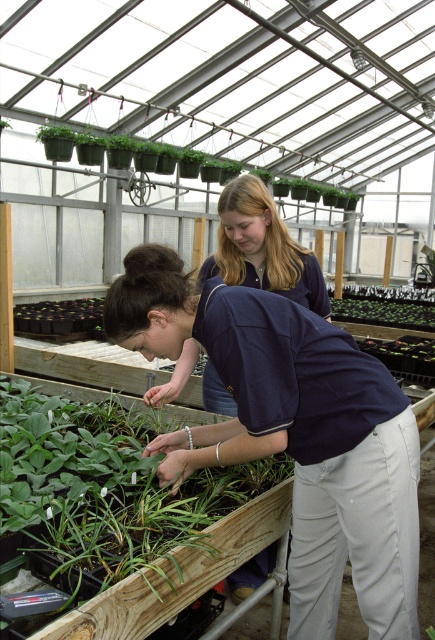
You are standing at the entrance of the greenhouse and see two points marked in the scene. Which point is closer to you, point (214, 461) or point (391, 301)?

Point (214, 461) is in front of point (391, 301), so it is closer to you.

You are a maintenance worker in the greenhouse. You need to reach the green matte hanging plants at upper center from the green leafy plant at center. Can you walk directly to it without moving any obstacles?

The distance between the green leafy plant at center and the green matte hanging plants at upper center is 9.12 meters. Since there is no mention of obstacles in the scene description, you can walk directly to it.